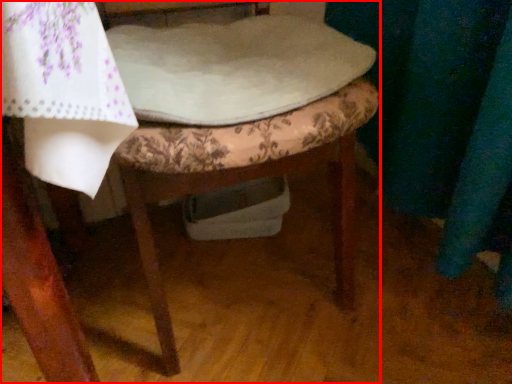
Question: Where is chair (annotated by the red box) located in relation to sheet in the image?

Choices:
 (A) right
 (B) left

Answer: (B)